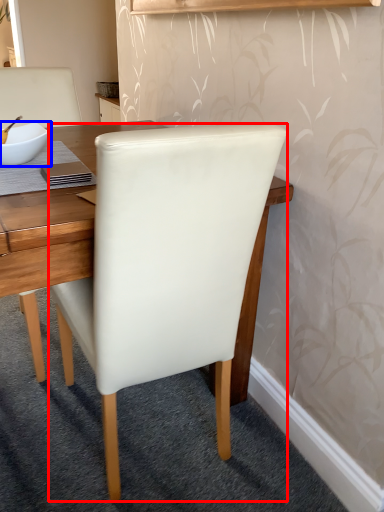
Question: Which object is closer to the camera taking this photo, chair (highlighted by a red box) or bowl (highlighted by a blue box)?

Choices:
 (A) chair
 (B) bowl

Answer: (A)